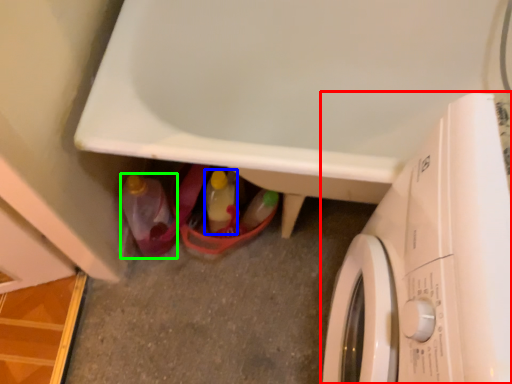
Question: Which object is positioned farthest from washing machine (highlighted by a red box)? Select from bottle (highlighted by a blue box) and bottle (highlighted by a green box).

Choices:
 (A) bottle
 (B) bottle

Answer: (B)